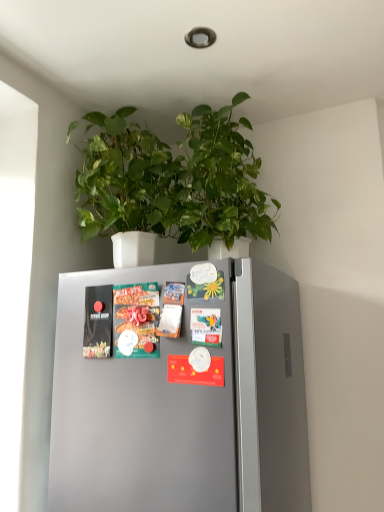
Question: Is green glossy leaves at upper center directly adjacent to matte black magazine at left, marked as the first magazine in a left-to-right arrangement?

Choices:
 (A) yes
 (B) no

Answer: (B)

Question: Is green glossy leaves at upper center oriented away from matte black magazine at left, marked as the first magazine in a left-to-right arrangement?

Choices:
 (A) no
 (B) yes

Answer: (A)

Question: Can you confirm if green glossy leaves at upper center is positioned to the left of matte black magazine at left, placed as the second magazine when sorted from right to left?

Choices:
 (A) yes
 (B) no

Answer: (B)

Question: Does green glossy leaves at upper center turn towards matte black magazine at left, marked as the first magazine in a left-to-right arrangement?

Choices:
 (A) yes
 (B) no

Answer: (B)

Question: From a real-world perspective, is green glossy leaves at upper center below matte black magazine at left, marked as the first magazine in a left-to-right arrangement?

Choices:
 (A) no
 (B) yes

Answer: (A)

Question: Is there a large distance between green glossy leaves at upper center and matte black magazine at left, marked as the first magazine in a left-to-right arrangement?

Choices:
 (A) yes
 (B) no

Answer: (B)

Question: Is matte plastic magazine at center, which is the first magazine in right-to-left order, behind matte black magazine at left, placed as the second magazine when sorted from right to left?

Choices:
 (A) yes
 (B) no

Answer: (B)

Question: Is matte plastic magazine at center, the 2th magazine from the left, completely or partially outside of matte black magazine at left, placed as the second magazine when sorted from right to left?

Choices:
 (A) no
 (B) yes

Answer: (B)

Question: Is matte plastic magazine at center, which is the first magazine in right-to-left order, surrounding matte black magazine at left, marked as the first magazine in a left-to-right arrangement?

Choices:
 (A) yes
 (B) no

Answer: (B)

Question: Can you confirm if matte plastic magazine at center, which is the first magazine in right-to-left order, is smaller than matte black magazine at left, marked as the first magazine in a left-to-right arrangement?

Choices:
 (A) yes
 (B) no

Answer: (B)

Question: From a real-world perspective, is matte plastic magazine at center, the 2th magazine from the left, under matte black magazine at left, marked as the first magazine in a left-to-right arrangement?

Choices:
 (A) no
 (B) yes

Answer: (B)

Question: Does matte plastic magazine at center, which is the first magazine in right-to-left order, have a larger size compared to matte black magazine at left, marked as the first magazine in a left-to-right arrangement?

Choices:
 (A) yes
 (B) no

Answer: (A)

Question: From the image's perspective, does green glossy leaves at upper center appear lower than matte plastic magazine at center, the 2th magazine from the left?

Choices:
 (A) yes
 (B) no

Answer: (B)